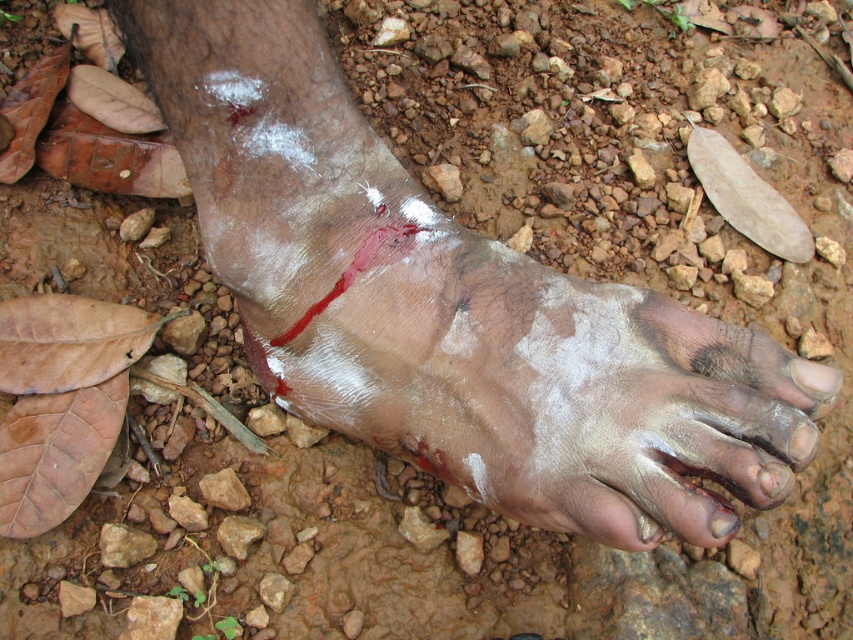
Question: Estimate the real-world distances between objects in this image. Which object is closer to the dirty skin foot at lower center?

Choices:
 (A) pale skin toe at center
 (B) scabbed skin foot at center
 (C) shiny skin toe at lower right

Answer: (B)

Question: Estimate the real-world distances between objects in this image. Which object is farther from the dirty skin foot at lower center?

Choices:
 (A) shiny skin toe at lower right
 (B) pale skin toe at center

Answer: (B)

Question: Does dirty skin foot at lower center have a lesser width compared to pale skin toe at center?

Choices:
 (A) no
 (B) yes

Answer: (A)

Question: Based on their relative distances, which object is nearer to the pale skin toe at center?

Choices:
 (A) scabbed skin foot at center
 (B) dirty skin foot at lower center

Answer: (B)

Question: Can you confirm if scabbed skin foot at center is bigger than shiny skin toe at lower right?

Choices:
 (A) no
 (B) yes

Answer: (B)

Question: Does dirty skin foot at lower center appear on the left side of pale skin toe at center?

Choices:
 (A) yes
 (B) no

Answer: (A)